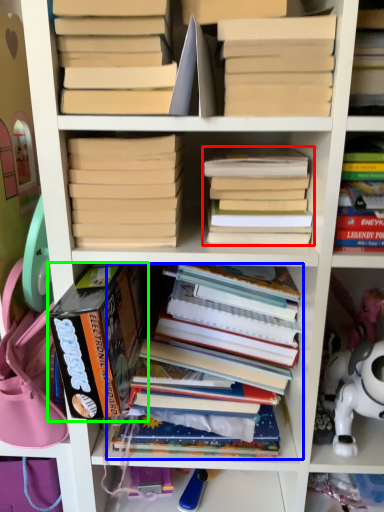
Question: Which object is positioned farthest from book (highlighted by a red box)? Select from book (highlighted by a blue box) and book (highlighted by a green box).

Choices:
 (A) book
 (B) book

Answer: (A)